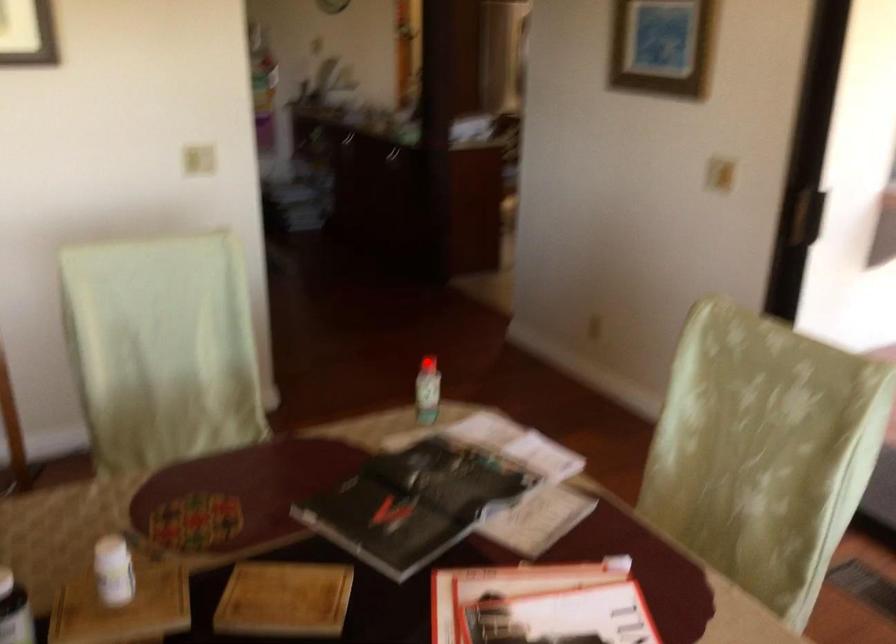
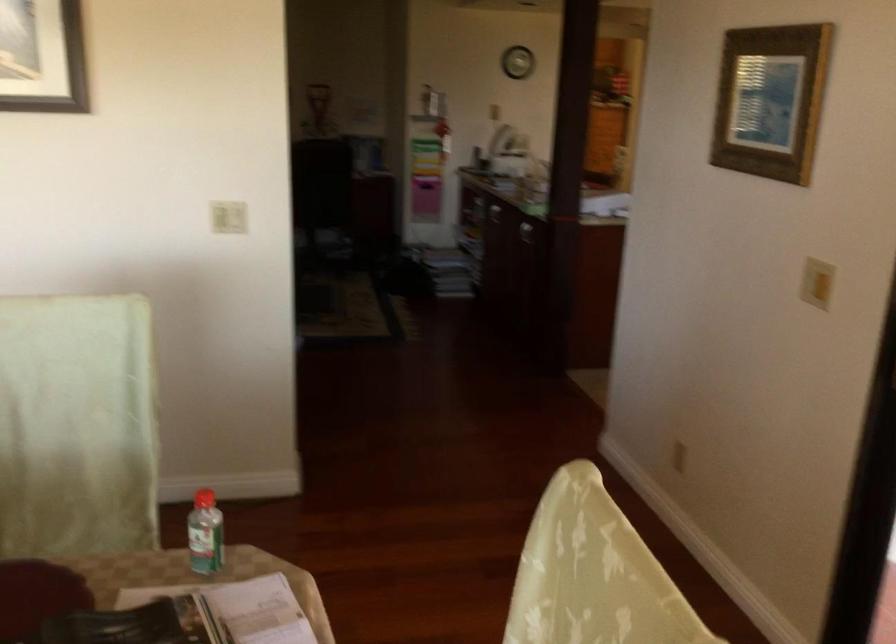
Question: I am providing you with two images of the same scene from different viewpoints. Image1 has a red point marked. In image2, the corresponding 3D location appears at what relative position? Reply with the corresponding letter.

Choices:
 (A) Closer
 (B) Farther

Answer: (A)